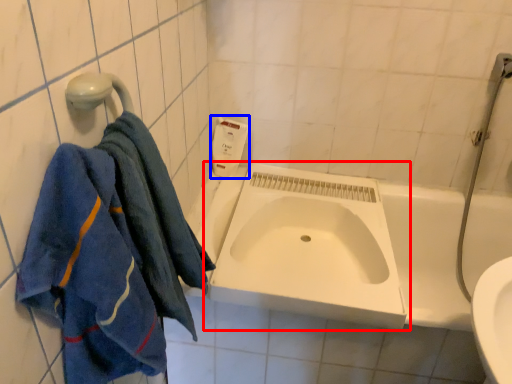
Question: Among these objects, which one is nearest to the camera, sink (highlighted by a red box) or soap dispenser (highlighted by a blue box)?

Choices:
 (A) sink
 (B) soap dispenser

Answer: (A)